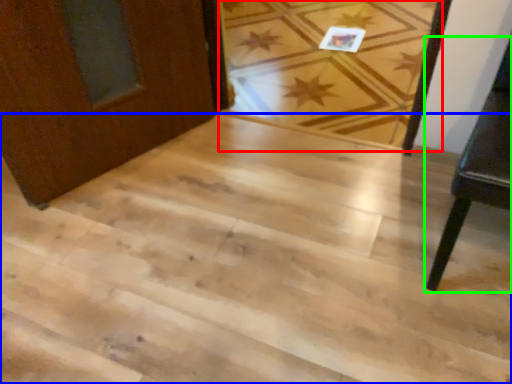
Question: Which object is the closest to the plank (highlighted by a red box)? Choose among these: stairwell (highlighted by a blue box) or furniture (highlighted by a green box).

Choices:
 (A) stairwell
 (B) furniture

Answer: (A)